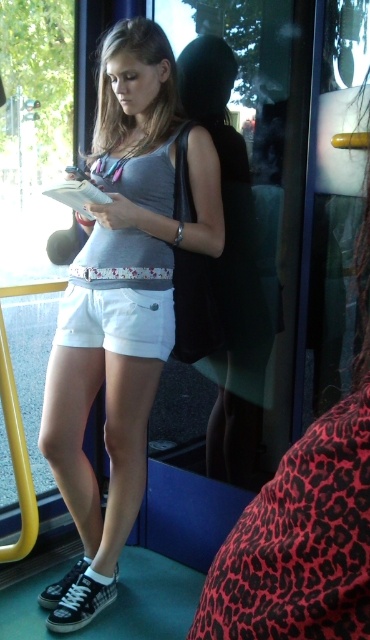
Question: Is matte gray tank top at center wider than white cotton shorts at center?

Choices:
 (A) no
 (B) yes

Answer: (B)

Question: Can you confirm if matte gray tank top at center is bigger than leopard print skirt at center?

Choices:
 (A) yes
 (B) no

Answer: (A)

Question: Which object appears farthest from the camera in this image?

Choices:
 (A) white cotton shorts at center
 (B) matte gray tank top at center

Answer: (A)

Question: Based on their relative distances, which object is farther from the white cotton shorts at center?

Choices:
 (A) matte gray tank top at center
 (B) leopard print skirt at center

Answer: (B)

Question: From the image, what is the correct spatial relationship of matte gray tank top at center in relation to white cotton shorts at center?

Choices:
 (A) above
 (B) below

Answer: (B)

Question: Which of the following is the farthest from the observer?

Choices:
 (A) (165, 312)
 (B) (196, 163)

Answer: (A)